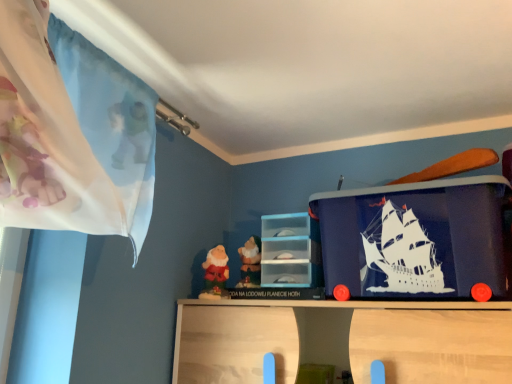
Question: Considering the relative positions of matte plastic dwarf at center, marked as the second toy in a left-to-right arrangement, and transparent plastic drawer at center in the image provided, is matte plastic dwarf at center, marked as the second toy in a left-to-right arrangement, in front of transparent plastic drawer at center?

Choices:
 (A) no
 (B) yes

Answer: (A)

Question: From a real-world perspective, is matte plastic dwarf at center, the 1th toy from the right, over transparent plastic drawer at center?

Choices:
 (A) no
 (B) yes

Answer: (A)

Question: Does matte plastic dwarf at center, marked as the second toy in a left-to-right arrangement, have a lesser width compared to transparent plastic drawer at center?

Choices:
 (A) yes
 (B) no

Answer: (A)

Question: Does matte plastic dwarf at center, marked as the second toy in a left-to-right arrangement, appear on the left side of transparent plastic drawer at center?

Choices:
 (A) yes
 (B) no

Answer: (A)

Question: Does matte plastic dwarf at center, the 1th toy from the right, have a smaller size compared to transparent plastic drawer at center?

Choices:
 (A) yes
 (B) no

Answer: (A)

Question: Visually, is transparent plastic drawer at center positioned to the left or to the right of matte plastic dwarf at center, marked as the second toy in a left-to-right arrangement?

Choices:
 (A) left
 (B) right

Answer: (B)

Question: From the image's perspective, is transparent plastic drawer at center positioned above or below matte plastic dwarf at center, marked as the second toy in a left-to-right arrangement?

Choices:
 (A) below
 (B) above

Answer: (B)

Question: In terms of width, does transparent plastic drawer at center look wider or thinner when compared to matte plastic dwarf at center, marked as the second toy in a left-to-right arrangement?

Choices:
 (A) wide
 (B) thin

Answer: (A)

Question: From a real-world perspective, is transparent plastic drawer at center above or below matte plastic dwarf at center, the 1th toy from the right?

Choices:
 (A) above
 (B) below

Answer: (A)

Question: From a real-world perspective, relative to transparent plastic drawer at center, is matte plastic dwarf at center, marked as the second toy in a left-to-right arrangement, vertically above or below?

Choices:
 (A) below
 (B) above

Answer: (A)

Question: Is matte plastic dwarf at center, the 1th toy from the right, to the left or to the right of transparent plastic drawer at center in the image?

Choices:
 (A) right
 (B) left

Answer: (B)

Question: Considering the positions of point (245, 286) and point (280, 251), is point (245, 286) closer or farther from the camera than point (280, 251)?

Choices:
 (A) closer
 (B) farther

Answer: (B)

Question: Relative to transparent plastic drawer at center, is matte plastic dwarf at center, the 1th toy from the right, in front or behind?

Choices:
 (A) front
 (B) behind

Answer: (B)

Question: In terms of width, does velvet red dwarf at center, which is counted as the 1th toy, starting from the left, look wider or thinner when compared to matte plastic dwarf at center, the 1th toy from the right?

Choices:
 (A) thin
 (B) wide

Answer: (B)

Question: From a real-world perspective, is velvet red dwarf at center, placed as the second toy when sorted from right to left, positioned above or below matte plastic dwarf at center, the 1th toy from the right?

Choices:
 (A) below
 (B) above

Answer: (A)